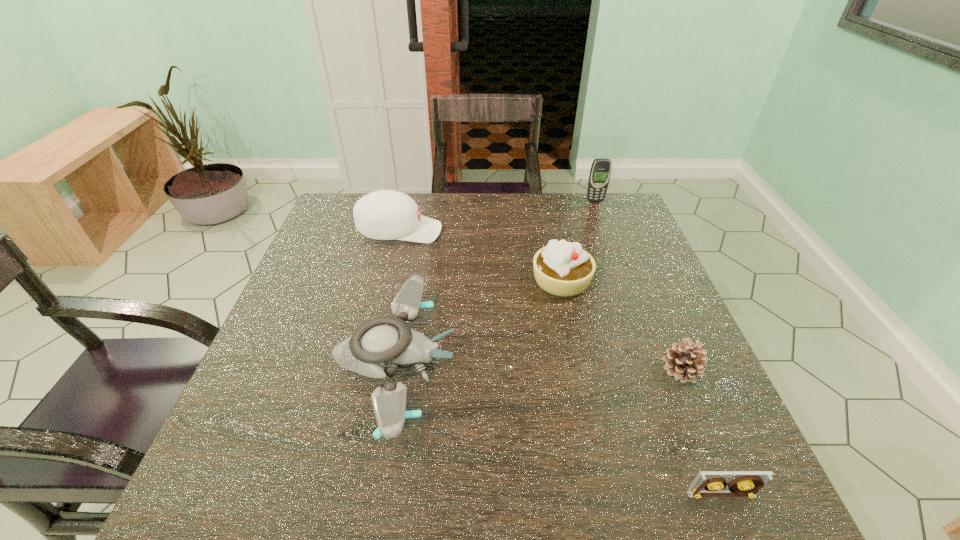
Find the location of a particular element. Image resolution: width=960 pixels, height=540 pixels. vacant space that satisfies the following two spatial constraints: 1. on the front-facing side of the pinecone; 2. on the left side of the drone is located at coordinates (395, 371).

Where is `free location that satisfies the following two spatial constraints: 1. on the front-facing side of the drone; 2. on the right side of the pinecone`? This screenshot has width=960, height=540. free location that satisfies the following two spatial constraints: 1. on the front-facing side of the drone; 2. on the right side of the pinecone is located at coordinates (395, 371).

Find the location of a particular element. vacant space that satisfies the following two spatial constraints: 1. on the front-facing side of the drone; 2. on the right side of the pinecone is located at coordinates (395, 371).

Identify the location of free space that satisfies the following two spatial constraints: 1. on the screen of the pinecone; 2. on the left side of the farthest object. (659, 371).

Image resolution: width=960 pixels, height=540 pixels. Identify the location of free region that satisfies the following two spatial constraints: 1. on the front-facing side of the baseball cap; 2. on the left side of the pinecone. 367,371.